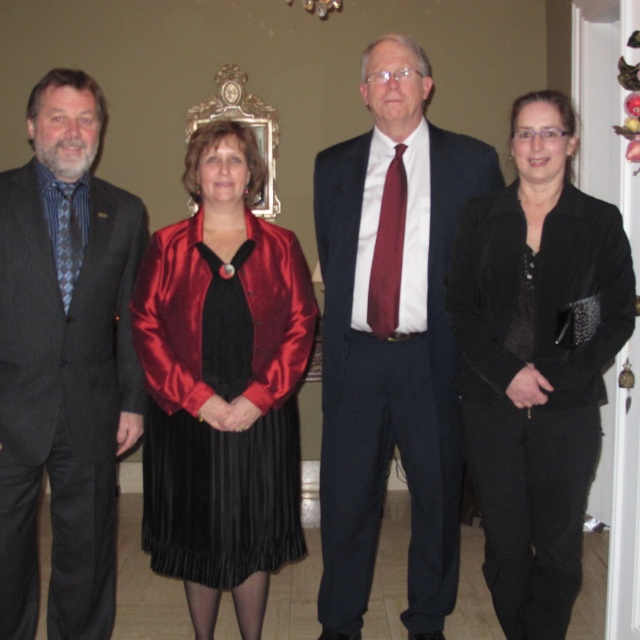
You are a photographer at the event and need to ensure both the velvet black jacket at center and the burgundy silk tie at center are visible in the frame. Given their positions, which one might require you to adjust your camera angle to capture fully?

The velvet black jacket at center is taller than the burgundy silk tie at center, so you might need to adjust the camera angle to ensure the taller velvet black jacket at center is fully captured in the frame.

You are an interior designer analyzing the layout of this room. The room has a decorative mirror with ornate detailing in the background. Where is the satin black dress at center positioned in relation to the mirror?

The satin black dress at center is positioned at coordinates approximately 0.623 along the horizontal axis and 0.350 along the vertical axis, but without specific mirror coordinates, precise spatial relation to the mirror cannot be determined.

You are organizing a charity event and need to display two items from the image on a table. The velvet black jacket at center and the burgundy silk tie at center must be placed side by side. Which item should you place on the left to ensure the larger item is on the right side of the table?

The velvet black jacket at center is larger than the burgundy silk tie at center. To have the larger item on the right side of the table, place the burgundy silk tie at center on the left and the velvet black jacket at center on the right.